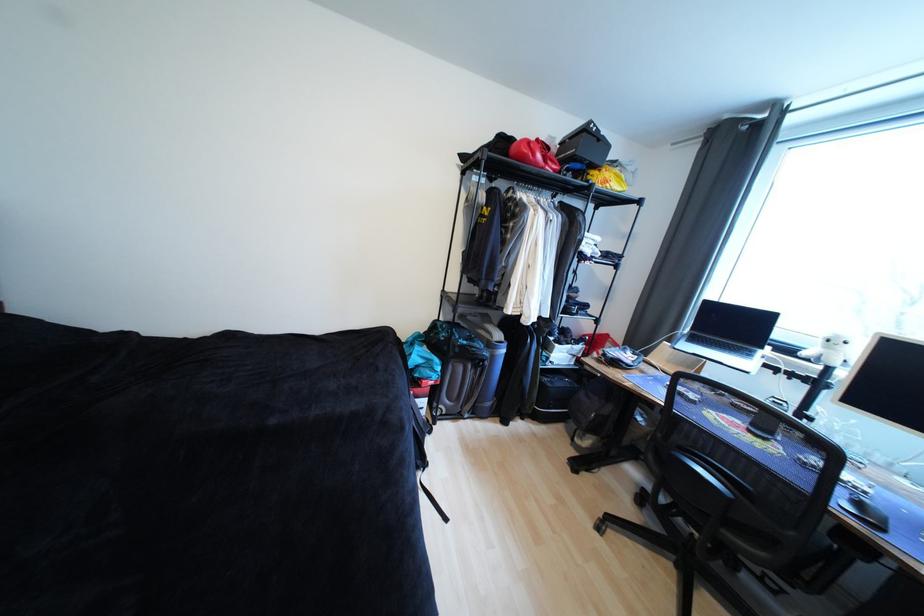
Find where to lift the white plush toy. Please return your answer as a coordinate pair (x, y).

(830, 350)